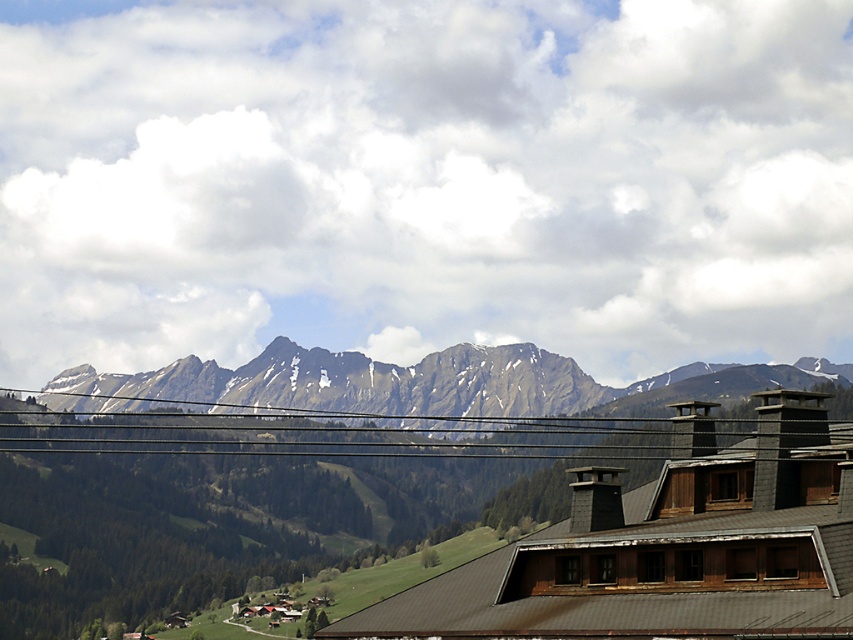
Question: Is green textured mountain range at center further to the viewer compared to black wire at center?

Choices:
 (A) no
 (B) yes

Answer: (B)

Question: From the image, what is the correct spatial relationship of green textured mountain range at center in relation to black wire at center?

Choices:
 (A) left
 (B) right

Answer: (B)

Question: Which point appears closest to the camera in this image?

Choices:
 (A) (405, 387)
 (B) (680, 442)

Answer: (B)

Question: Is green textured mountain range at center thinner than black wire at center?

Choices:
 (A) yes
 (B) no

Answer: (B)